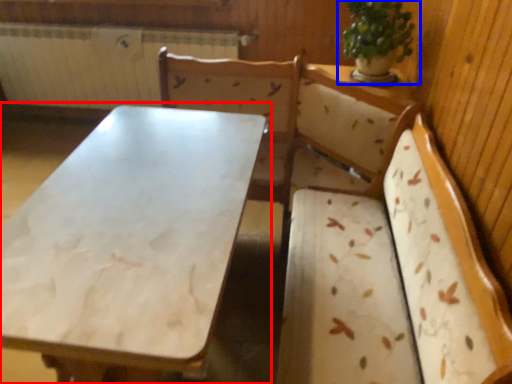
Question: Which of the following is the closest to the observer, table (highlighted by a red box) or houseplant (highlighted by a blue box)?

Choices:
 (A) table
 (B) houseplant

Answer: (A)